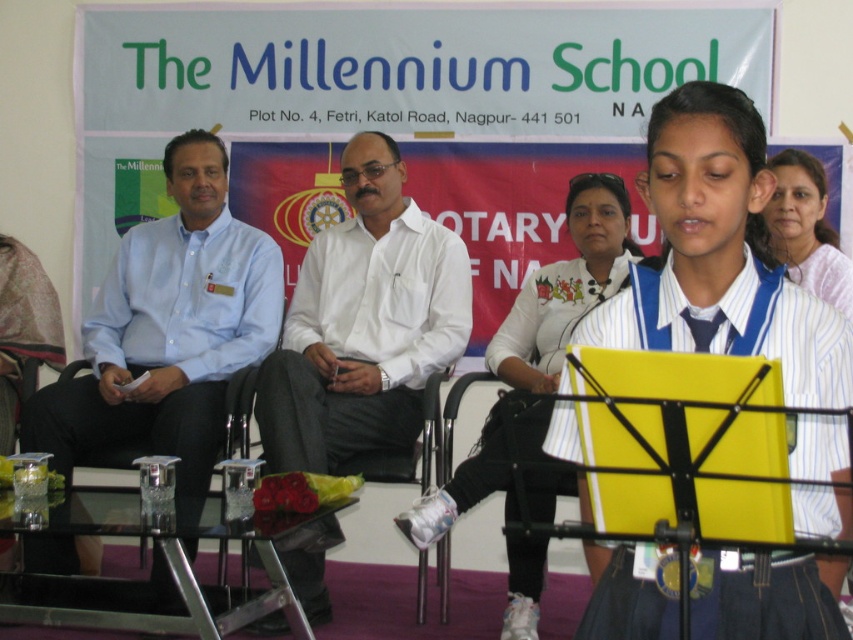
Question: Among these points, which one is nearest to the camera?

Choices:
 (A) 637,636
 (B) 827,282
 (C) 78,384

Answer: (A)

Question: Can you confirm if light blue shirt at left is positioned above white striped fabric at center?

Choices:
 (A) no
 (B) yes

Answer: (B)

Question: Which of these objects is positioned closest to the white smooth shirt at center?

Choices:
 (A) white striped fabric at center
 (B) white striped shirt at upper right

Answer: (B)

Question: Which point is farther from the camera taking this photo?

Choices:
 (A) (47, 403)
 (B) (293, 397)

Answer: (A)

Question: Does white smooth shirt at center appear on the right side of white striped shirt at center?

Choices:
 (A) no
 (B) yes

Answer: (A)

Question: Does light blue shirt at left have a larger size compared to white smooth shirt at center?

Choices:
 (A) yes
 (B) no

Answer: (A)